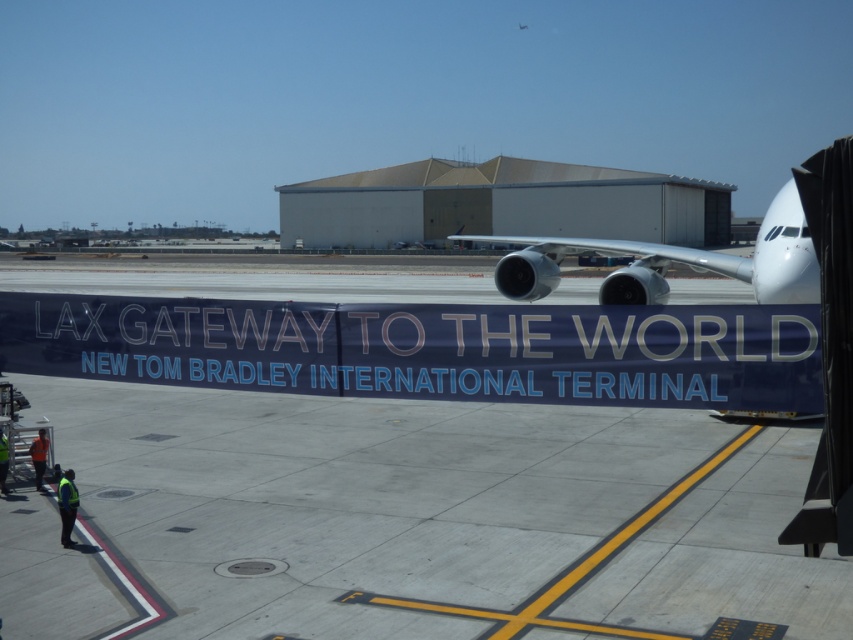
You are a maintenance worker standing on the gray concrete tarmac at center and need to reach the silver metallic airplane at right. Which direction should you walk to get there?

You should walk to the right because the gray concrete tarmac at center is to the left of the silver metallic airplane at right.

From the picture: You are a maintenance worker on the gray concrete tarmac at center and need to inspect the silver metallic airplane at right. Which direction should you move to reach the airplane?

The gray concrete tarmac at center is below the silver metallic airplane at right, so you should move upward to reach the airplane.